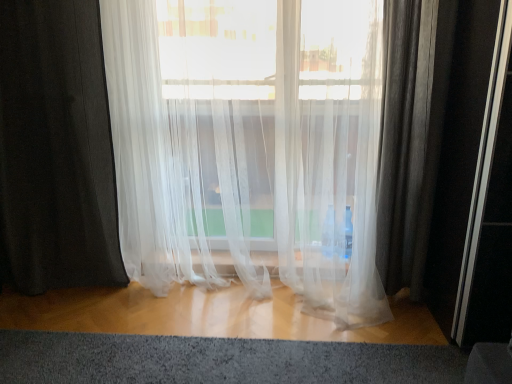
Where is `vacant area that is in front of translucent white curtain at center, the 1th curtain when ordered from right to left`? Image resolution: width=512 pixels, height=384 pixels. vacant area that is in front of translucent white curtain at center, the 1th curtain when ordered from right to left is located at coordinates (229, 346).